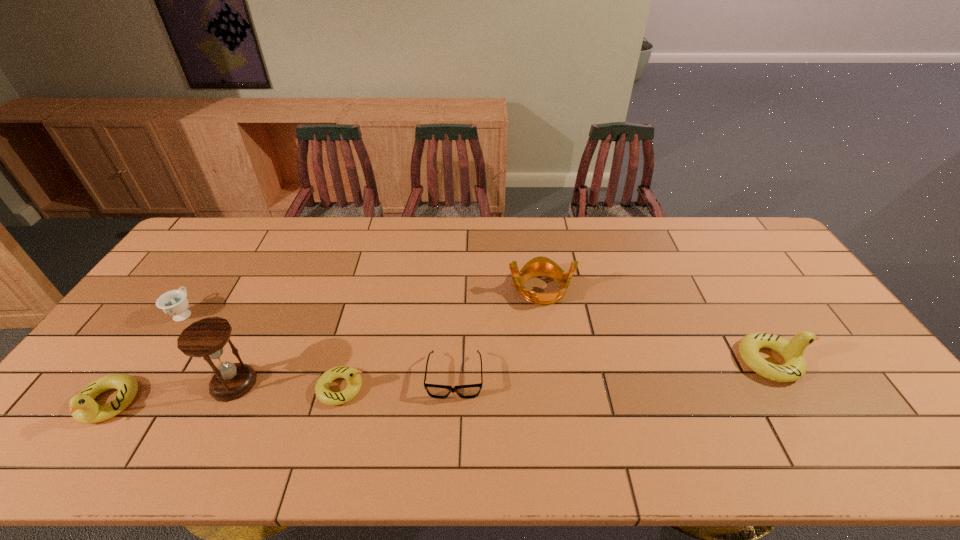
Locate an element on the screen. vacant space in between the fourth tallest object and the sunglasses is located at coordinates click(x=281, y=390).

Identify which object is located as the sixth nearest to the leftmost duckling. Please provide its 2D coordinates. Your answer should be formatted as a tuple, i.e. [(x, y)], where the tuple contains the x and y coordinates of a point satisfying the conditions above.

[(794, 368)]

Identify the location of object that is the sixth closest to the second shortest duckling. This screenshot has height=540, width=960. (794, 368).

Find the location of a particular element. duckling that stands as the second closest to the rightmost object is located at coordinates (83, 407).

Image resolution: width=960 pixels, height=540 pixels. I want to click on duckling identified as the second closest to the second tallest duckling, so click(794, 368).

I want to click on free region that satisfies the following two spatial constraints: 1. on the face of the shortest duckling; 2. on the face of the fourth shortest object, so click(338, 403).

Where is `blank space that satisfies the following two spatial constraints: 1. on the face of the rightmost object; 2. on the face of the leftmost duckling`? blank space that satisfies the following two spatial constraints: 1. on the face of the rightmost object; 2. on the face of the leftmost duckling is located at coordinates (797, 403).

Locate an element on the screen. This screenshot has width=960, height=540. blank space that satisfies the following two spatial constraints: 1. at the front emblem of the tiara; 2. on the face of the second tallest duckling is located at coordinates (557, 403).

You are a GUI agent. You are given a task and a screenshot of the screen. Output one action in this format:
    pyautogui.click(x=<x>, y=<y>)
    Task: Click on the vacant space that satisfies the following two spatial constraints: 1. on the face of the second duckling from left to right; 2. on the face of the second shortest duckling
    The height and width of the screenshot is (540, 960).
    Given the screenshot: What is the action you would take?
    pyautogui.click(x=338, y=403)

Locate an element on the screen. This screenshot has width=960, height=540. free space that satisfies the following two spatial constraints: 1. at the front emblem of the tiara; 2. on the face of the leftmost duckling is located at coordinates (557, 403).